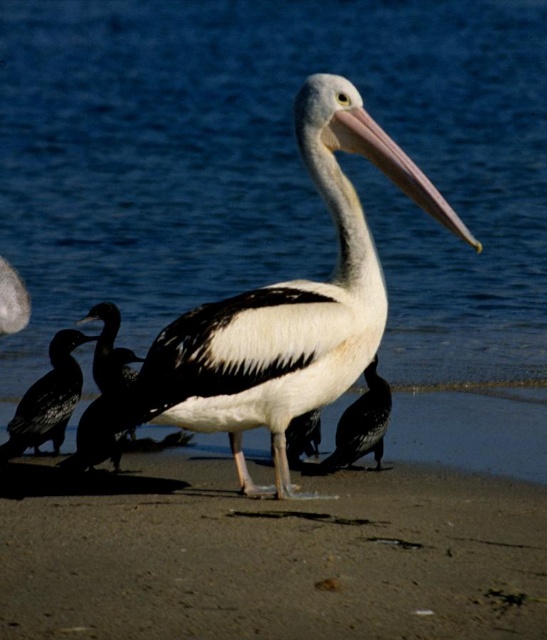
Question: Among these objects, which one is nearest to the camera?

Choices:
 (A) black glossy bird at center
 (B) white smooth beak at center
 (C) blue water at center

Answer: (B)

Question: Is shiny black bird at lower left to the right of white smooth beak at center from the viewer's perspective?

Choices:
 (A) no
 (B) yes

Answer: (A)

Question: Can you confirm if white glossy pelican at center is positioned to the right of white smooth beak at center?

Choices:
 (A) yes
 (B) no

Answer: (B)

Question: Can you confirm if shiny black bird at lower left is positioned to the right of black glossy bird at center?

Choices:
 (A) yes
 (B) no

Answer: (B)

Question: Which point is closer to the camera?

Choices:
 (A) (154, 32)
 (B) (353, 273)
 (C) (37, 448)

Answer: (B)

Question: Which point is closer to the camera taking this photo?

Choices:
 (A) (212, 618)
 (B) (60, 365)
 (C) (342, 428)
 (D) (486, 278)

Answer: (A)